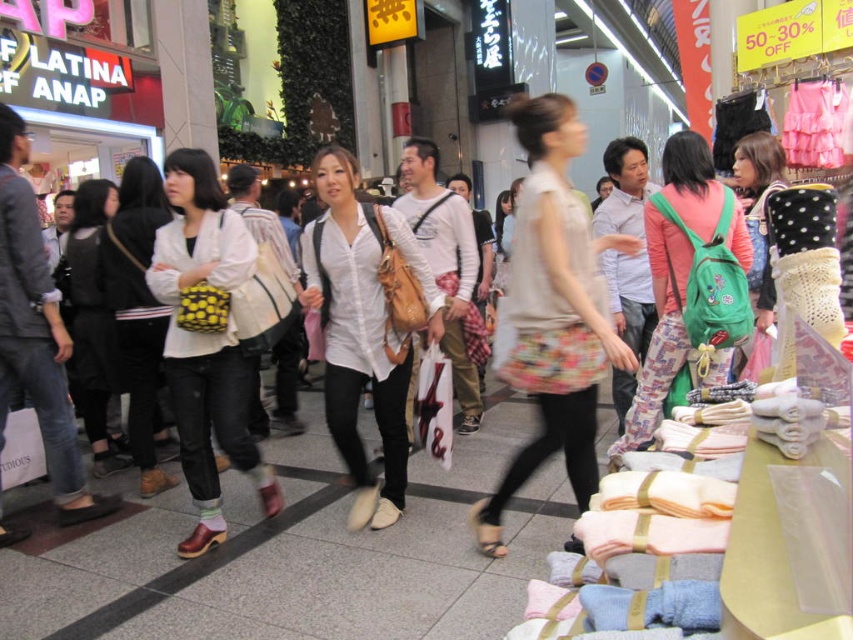
Can you confirm if floral skirt at center is positioned to the left of green backpack at center?

Indeed, floral skirt at center is positioned on the left side of green backpack at center.

Describe the element at coordinates (553, 310) in the screenshot. I see `floral skirt at center` at that location.

Measure the distance between point (x=515, y=472) and camera.

Point (x=515, y=472) is 2.96 meters from camera.

What are the coordinates of `floral skirt at center` in the screenshot? It's located at (553, 310).

Does matte yellow and black bag at center have a greater height compared to matte yellow bag at center?

In fact, matte yellow and black bag at center may be shorter than matte yellow bag at center.

Is matte yellow and black bag at center to the right of matte yellow bag at center from the viewer's perspective?

Correct, you'll find matte yellow and black bag at center to the right of matte yellow bag at center.

Image resolution: width=853 pixels, height=640 pixels. In order to click on matte yellow and black bag at center in this screenshot , I will do `click(206, 340)`.

Which of these two, floral skirt at center or white matte shirt at center, stands taller?

With more height is floral skirt at center.

Does floral skirt at center have a lesser width compared to white matte shirt at center?

In fact, floral skirt at center might be wider than white matte shirt at center.

Measure the distance between point (579, 282) and camera.

They are 8.96 feet apart.

Find the location of a particular element. floral skirt at center is located at coordinates (553, 310).